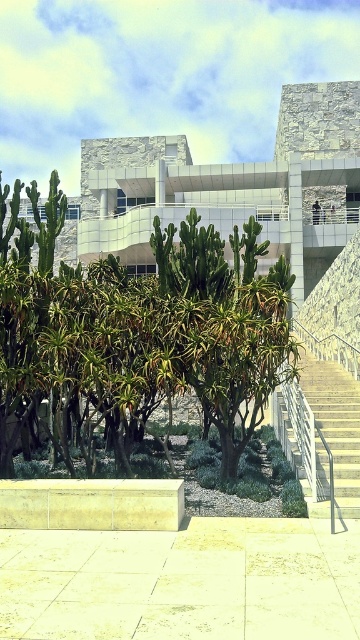
You are a visitor at the museum and want to take a photo of the white concrete stairs at right while also including the green leafy tree at center in the background. Which side of the stairs should you stand on to ensure the tree is visible behind them?

You should stand on the left side of the white concrete stairs at right because the green leafy tree at center is positioned to the left of the stairs, allowing it to be visible in the background when photographed from that angle.

You are standing in the museum courtyard and want to reach the entrance located at the top of the white concrete stairs at right. As you look towards the stairs, there is a green leafy tree at center blocking your view. Which direction should you move to avoid the tree and get a clear path to the stairs?

You should move to the right side of the green leafy tree at center to avoid it and get a clear path to the white concrete stairs at right, since the tree is closer to you than the stairs and moving sideways around it would provide an unobstructed view.